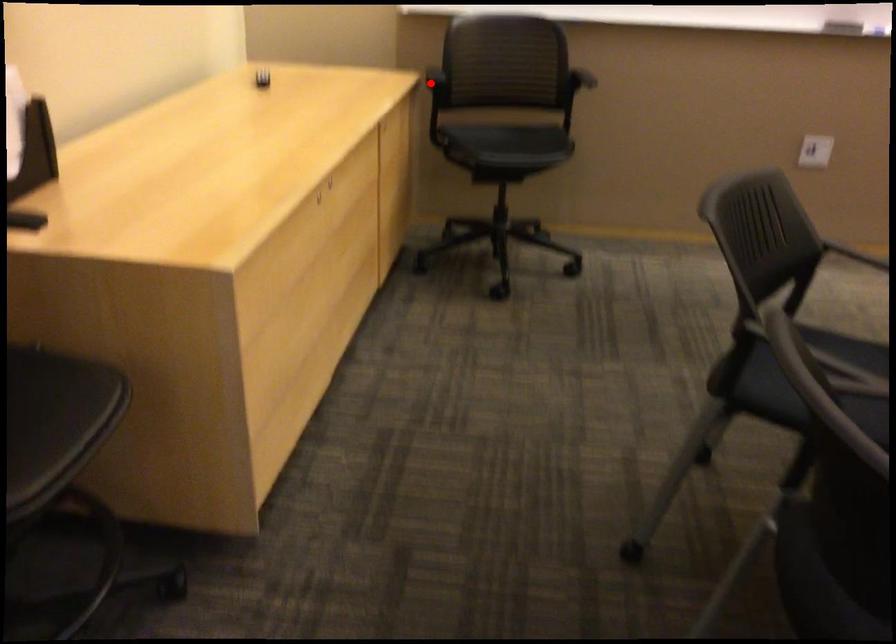
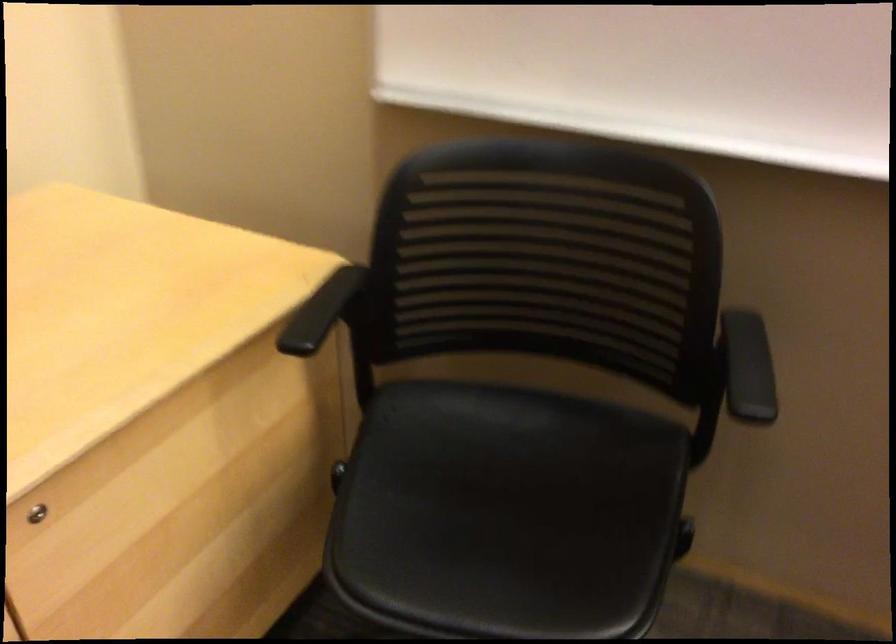
Question: A red point is marked in image1. In image2, is the corresponding 3D point closer to the camera or farther? Reply with the corresponding letter.

Choices:
 (A) The corresponding 3D point is closer.
 (B) The corresponding 3D point is farther.

Answer: (A)